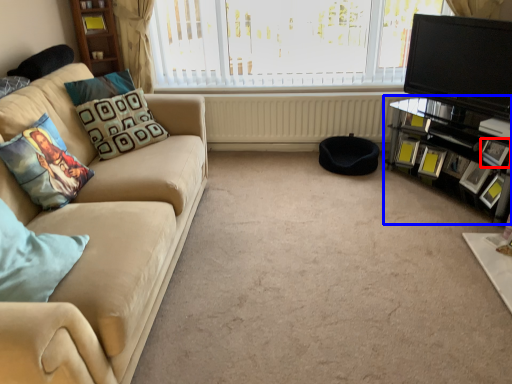
Question: Which of the following is the farthest to the observer, picture frame (highlighted by a red box) or entertainment center (highlighted by a blue box)?

Choices:
 (A) picture frame
 (B) entertainment center

Answer: (A)